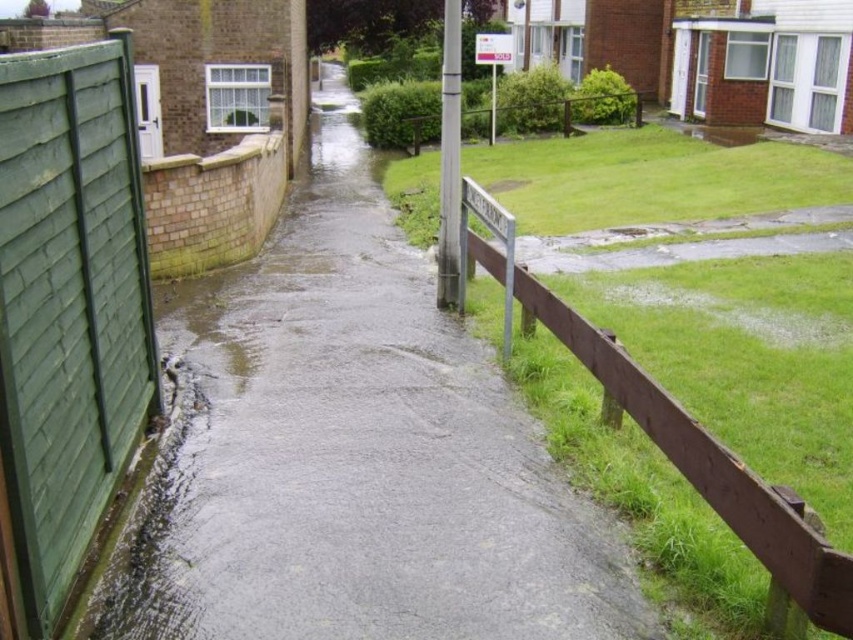
Which of these two, brown wooden fence at upper center or white plastic sign at center, stands taller?

Standing taller between the two is white plastic sign at center.

Can you confirm if brown wooden fence at upper center is wider than white plastic sign at center?

Yes.

This screenshot has width=853, height=640. What do you see at coordinates (596, 99) in the screenshot?
I see `brown wooden fence at upper center` at bounding box center [596, 99].

Where is `brown wooden fence at upper center`? brown wooden fence at upper center is located at coordinates (596, 99).

You are a GUI agent. You are given a task and a screenshot of the screen. Output one action in this format:
    pyautogui.click(x=<x>, y=<y>)
    Task: Click on the brown wooden fence at lower right
    The height and width of the screenshot is (640, 853).
    Given the screenshot: What is the action you would take?
    pyautogui.click(x=672, y=433)

Which of these two, brown wooden fence at lower right or white plastic sign at center, stands shorter?

Standing shorter between the two is brown wooden fence at lower right.

Is point (519, 273) closer to camera compared to point (494, 45)?

Yes.

This screenshot has height=640, width=853. I want to click on brown wooden fence at lower right, so click(x=672, y=433).

Is point (39, 356) behind point (569, 99)?

That is False.

Is green wooden fence at left bigger than brown wooden fence at upper center?

Actually, green wooden fence at left might be smaller than brown wooden fence at upper center.

Locate an element on the screen. green wooden fence at left is located at coordinates (68, 307).